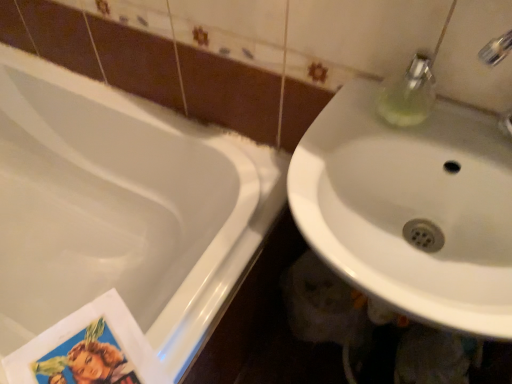
Question: Choose the correct answer: Is white glossy sink at right inside white glossy bathtub at lower left or outside it?

Choices:
 (A) inside
 (B) outside

Answer: (B)

Question: Considering the positions of point (441, 258) and point (157, 112), is point (441, 258) closer or farther from the camera than point (157, 112)?

Choices:
 (A) closer
 (B) farther

Answer: (A)

Question: Looking at their shapes, would you say white glossy sink at right is wider or thinner than white glossy bathtub at lower left?

Choices:
 (A) wide
 (B) thin

Answer: (B)

Question: Considering the positions of white glossy bathtub at lower left and white glossy sink at right in the image, is white glossy bathtub at lower left wider or thinner than white glossy sink at right?

Choices:
 (A) thin
 (B) wide

Answer: (B)

Question: Would you say white glossy bathtub at lower left is to the left or to the right of white glossy sink at right in the picture?

Choices:
 (A) left
 (B) right

Answer: (A)

Question: From the image's perspective, is white glossy bathtub at lower left located above or below white glossy sink at right?

Choices:
 (A) above
 (B) below

Answer: (B)

Question: Considering the positions of white glossy bathtub at lower left and white glossy sink at right in the image, is white glossy bathtub at lower left taller or shorter than white glossy sink at right?

Choices:
 (A) tall
 (B) short

Answer: (A)